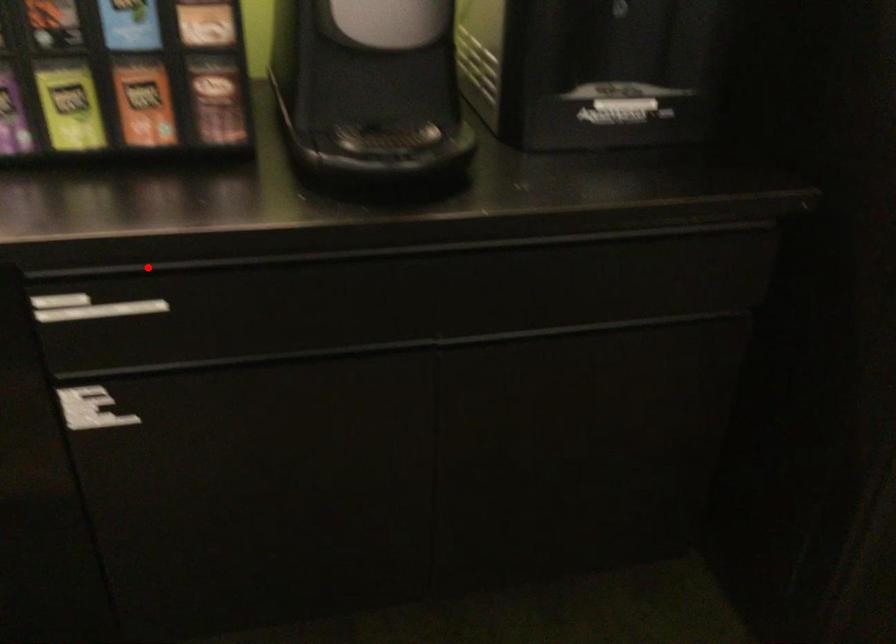
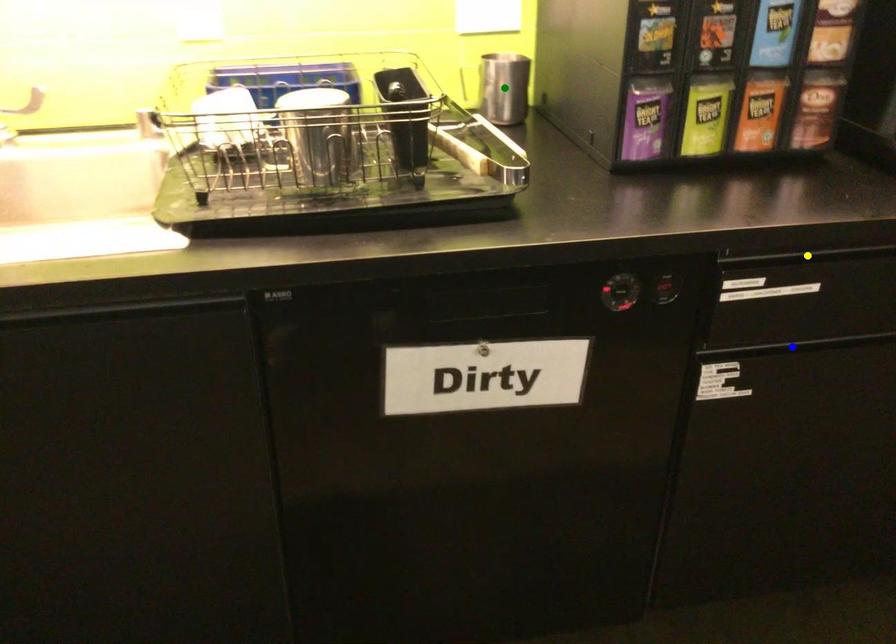
Question: I am providing you with two images of the same scene from different viewpoints. A red point is marked on the first image. You are given multiple points on the second image. Which spot in image 2 lines up with the point in image 1?

Choices:
 (A) green point
 (B) blue point
 (C) yellow point

Answer: (C)